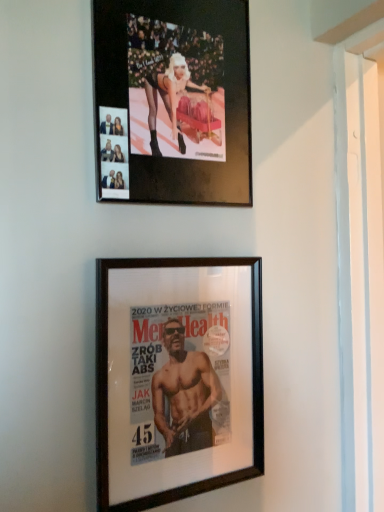
Question: Should I look upward or downward to see metallic gold photo frame at upper center, positioned as the 1th picture frame in top-to-bottom order?

Choices:
 (A) up
 (B) down

Answer: (A)

Question: Considering the relative sizes of black wood picture frame at center, the 1th picture frame ordered from the bottom, and metallic gold photo frame at upper center, acting as the 2th picture frame starting from the bottom, in the image provided, is black wood picture frame at center, the 1th picture frame ordered from the bottom, taller than metallic gold photo frame at upper center, acting as the 2th picture frame starting from the bottom,?

Choices:
 (A) no
 (B) yes

Answer: (B)

Question: Does black wood picture frame at center, the 1th picture frame ordered from the bottom, contain metallic gold photo frame at upper center, acting as the 2th picture frame starting from the bottom?

Choices:
 (A) yes
 (B) no

Answer: (B)

Question: Can you confirm if black wood picture frame at center, the second picture frame when ordered from top to bottom, is thinner than metallic gold photo frame at upper center, positioned as the 1th picture frame in top-to-bottom order?

Choices:
 (A) yes
 (B) no

Answer: (A)

Question: Does black wood picture frame at center, the 1th picture frame ordered from the bottom, have a lesser height compared to metallic gold photo frame at upper center, acting as the 2th picture frame starting from the bottom?

Choices:
 (A) yes
 (B) no

Answer: (B)

Question: Are black wood picture frame at center, the 1th picture frame ordered from the bottom, and metallic gold photo frame at upper center, positioned as the 1th picture frame in top-to-bottom order, beside each other?

Choices:
 (A) yes
 (B) no

Answer: (B)

Question: Can you confirm if black wood picture frame at center, the 1th picture frame ordered from the bottom, is smaller than metallic gold photo frame at upper center, acting as the 2th picture frame starting from the bottom?

Choices:
 (A) yes
 (B) no

Answer: (A)

Question: From the image's perspective, is metallic gold photo frame at upper center, positioned as the 1th picture frame in top-to-bottom order, located above black wood picture frame at center, the second picture frame when ordered from top to bottom?

Choices:
 (A) yes
 (B) no

Answer: (A)

Question: Is metallic gold photo frame at upper center, positioned as the 1th picture frame in top-to-bottom order, not near black wood picture frame at center, the 1th picture frame ordered from the bottom?

Choices:
 (A) yes
 (B) no

Answer: (B)

Question: Does metallic gold photo frame at upper center, acting as the 2th picture frame starting from the bottom, have a greater width compared to black wood picture frame at center, the 1th picture frame ordered from the bottom?

Choices:
 (A) yes
 (B) no

Answer: (A)

Question: From a real-world perspective, is metallic gold photo frame at upper center, positioned as the 1th picture frame in top-to-bottom order, located higher than black wood picture frame at center, the 1th picture frame ordered from the bottom?

Choices:
 (A) yes
 (B) no

Answer: (A)

Question: Does metallic gold photo frame at upper center, acting as the 2th picture frame starting from the bottom, have a greater height compared to black wood picture frame at center, the second picture frame when ordered from top to bottom?

Choices:
 (A) no
 (B) yes

Answer: (A)

Question: Is metallic gold photo frame at upper center, positioned as the 1th picture frame in top-to-bottom order, facing towards black wood picture frame at center, the second picture frame when ordered from top to bottom?

Choices:
 (A) yes
 (B) no

Answer: (B)

Question: Is black wood picture frame at center, the second picture frame when ordered from top to bottom, inside or outside of metallic gold photo frame at upper center, positioned as the 1th picture frame in top-to-bottom order?

Choices:
 (A) outside
 (B) inside

Answer: (A)